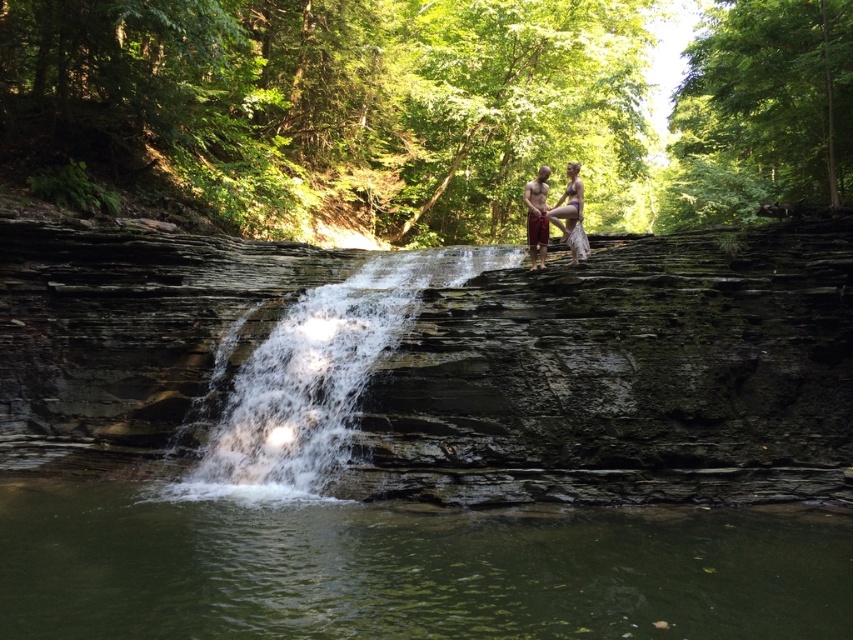
Question: Which point is closer to the camera?

Choices:
 (A) clear water at center
 (B) greenish water at lower center
 (C) matte white dress at center
 (D) matte skin couple at center

Answer: (B)

Question: Is greenish water at lower center bigger than clear water at center?

Choices:
 (A) no
 (B) yes

Answer: (A)

Question: Considering the relative positions of clear water at center and matte white dress at center in the image provided, where is clear water at center located with respect to matte white dress at center?

Choices:
 (A) right
 (B) left

Answer: (B)

Question: Which object is positioned closest to the matte skin couple at center?

Choices:
 (A) matte white dress at center
 (B) greenish water at lower center

Answer: (A)

Question: Is greenish water at lower center wider than clear water at center?

Choices:
 (A) yes
 (B) no

Answer: (A)

Question: Considering the real-world distances, which object is farthest from the greenish water at lower center?

Choices:
 (A) matte white dress at center
 (B) clear water at center
 (C) matte skin couple at center

Answer: (A)